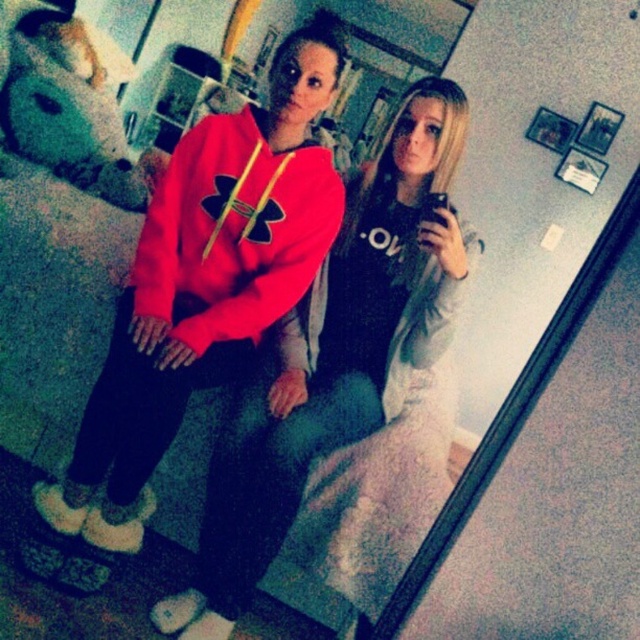
Question: Does matte fleece hoodie at center appear on the left side of matte red hoodie at center?

Choices:
 (A) no
 (B) yes

Answer: (B)

Question: Can you confirm if matte fleece hoodie at center is positioned below matte red hoodie at center?

Choices:
 (A) no
 (B) yes

Answer: (A)

Question: Which object appears closest to the camera in this image?

Choices:
 (A) matte red hoodie at center
 (B) matte fleece hoodie at center

Answer: (A)

Question: Is matte fleece hoodie at center positioned in front of matte red hoodie at center?

Choices:
 (A) yes
 (B) no

Answer: (B)

Question: Which point is closer to the camera taking this photo?

Choices:
 (A) (301, 38)
 (B) (300, 497)

Answer: (B)

Question: Which of the following is the closest to the observer?

Choices:
 (A) (273, 200)
 (B) (241, 467)

Answer: (B)